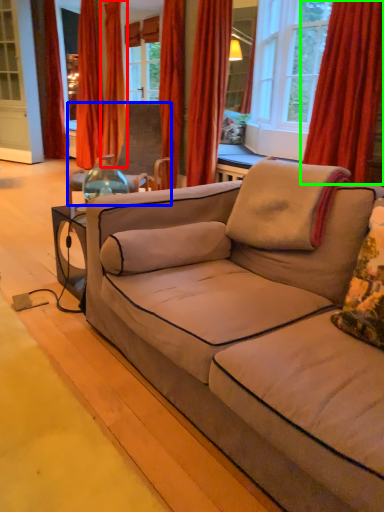
Question: Based on their relative distances, which object is nearer to curtain (highlighted by a red box)? Choose from chair (highlighted by a blue box) and curtain (highlighted by a green box).

Choices:
 (A) chair
 (B) curtain

Answer: (A)